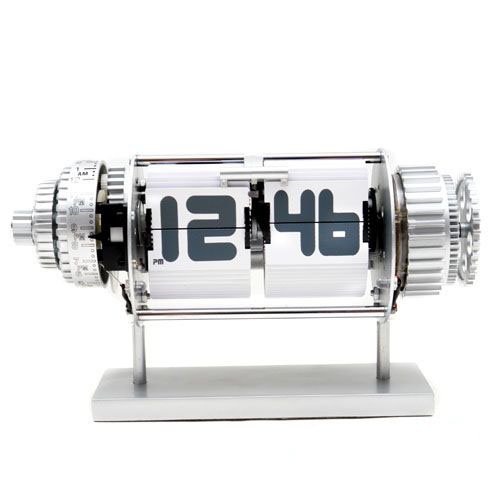
You are a GUI agent. You are given a task and a screenshot of the screen. Output one action in this format:
    pyautogui.click(x=<x>, y=<y>)
    Task: Click on the beam
    This screenshot has height=489, width=489.
    Given the screenshot: What is the action you would take?
    pyautogui.click(x=140, y=348)